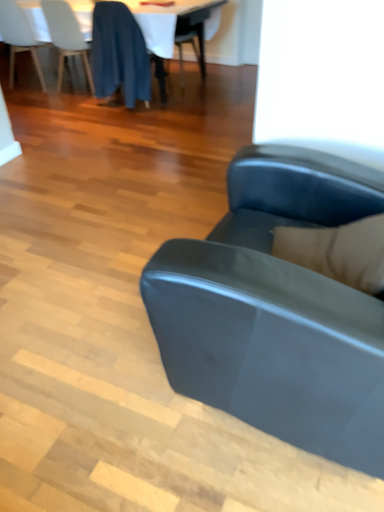
Question: Does white matte chair at upper left, the third chair positioned from the right, have a greater width compared to white glossy table at upper center?

Choices:
 (A) yes
 (B) no

Answer: (B)

Question: Does white matte chair at upper left, the third chair positioned from the right, appear on the right side of white glossy table at upper center?

Choices:
 (A) yes
 (B) no

Answer: (B)

Question: Is white matte chair at upper left, the third chair positioned from the right, oriented towards white glossy table at upper center?

Choices:
 (A) yes
 (B) no

Answer: (A)

Question: Does white matte chair at upper left, the 1th chair in the left-to-right sequence, lie behind white glossy table at upper center?

Choices:
 (A) no
 (B) yes

Answer: (B)

Question: Considering the relative sizes of white matte chair at upper left, the third chair positioned from the right, and white glossy table at upper center in the image provided, is white matte chair at upper left, the third chair positioned from the right, bigger than white glossy table at upper center?

Choices:
 (A) no
 (B) yes

Answer: (A)

Question: In terms of size, does dark blue fabric at upper left, placed as the third chair when sorted from left to right, appear bigger or smaller than white fabric table at upper center?

Choices:
 (A) big
 (B) small

Answer: (B)

Question: Is dark blue fabric at upper left, which is the 1th chair in right-to-left order, to the left or to the right of white fabric table at upper center in the image?

Choices:
 (A) left
 (B) right

Answer: (B)

Question: Considering the positions of dark blue fabric at upper left, which is the 1th chair in right-to-left order, and white fabric table at upper center in the image, is dark blue fabric at upper left, which is the 1th chair in right-to-left order, wider or thinner than white fabric table at upper center?

Choices:
 (A) thin
 (B) wide

Answer: (A)

Question: From a real-world perspective, is dark blue fabric at upper left, placed as the third chair when sorted from left to right, physically located above or below white fabric table at upper center?

Choices:
 (A) above
 (B) below

Answer: (A)

Question: From a real-world perspective, is matte black couch at center above or below white matte chair at upper left, the third chair positioned from the right?

Choices:
 (A) below
 (B) above

Answer: (B)

Question: Visually, is matte black couch at center positioned to the left or to the right of white matte chair at upper left, the third chair positioned from the right?

Choices:
 (A) right
 (B) left

Answer: (A)

Question: Relative to white matte chair at upper left, the third chair positioned from the right, is matte black couch at center in front or behind?

Choices:
 (A) behind
 (B) front

Answer: (B)

Question: From the image's perspective, relative to white matte chair at upper left, the 1th chair in the left-to-right sequence, is matte black couch at center above or below?

Choices:
 (A) above
 (B) below

Answer: (B)

Question: Relative to matte black couch at center, is white fabric table at upper center in front or behind?

Choices:
 (A) front
 (B) behind

Answer: (B)

Question: From the image's perspective, is white fabric table at upper center above or below matte black couch at center?

Choices:
 (A) below
 (B) above

Answer: (B)